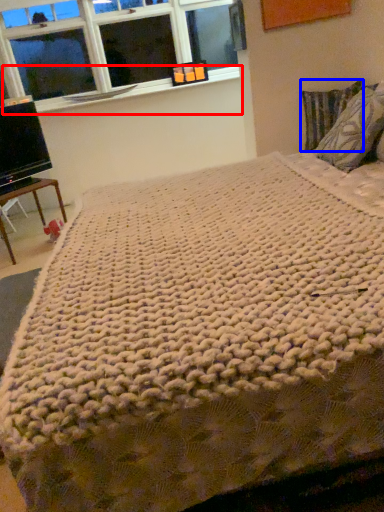
Question: Among these objects, which one is nearest to the camera, window sill (highlighted by a red box) or pillow (highlighted by a blue box)?

Choices:
 (A) window sill
 (B) pillow

Answer: (B)